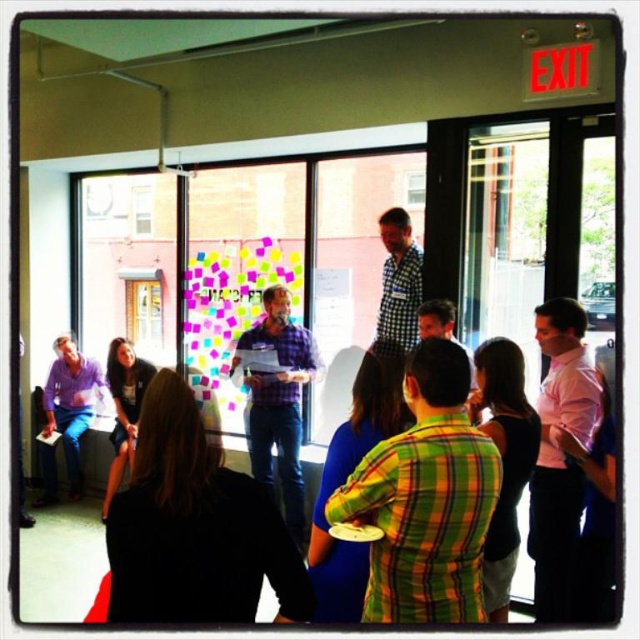
Who is more distant from viewer, [273,385] or [419,300]?

The point [273,385] is more distant.

Between plaid shirt at center and checkered fabric shirt at center, which one has less height?

checkered fabric shirt at center is shorter.

Which is in front, point (259, 323) or point (413, 259)?

Point (413, 259)

Locate an element on the screen. plaid shirt at center is located at coordinates (278, 403).

Is pink shirt at right thinner than plaid shirt at center?

Indeed, pink shirt at right has a lesser width compared to plaid shirt at center.

In the scene shown: Who is more forward, (536, 480) or (285, 456)?

Point (536, 480)

I want to click on pink shirt at right, so click(x=560, y=452).

Where is `pink shirt at right`? pink shirt at right is located at coordinates (560, 452).

Is green plaid shirt at center shorter than plaid shirt at center?

Correct, green plaid shirt at center is not as tall as plaid shirt at center.

Identify the location of green plaid shirt at center. (426, 499).

I want to click on green plaid shirt at center, so click(426, 499).